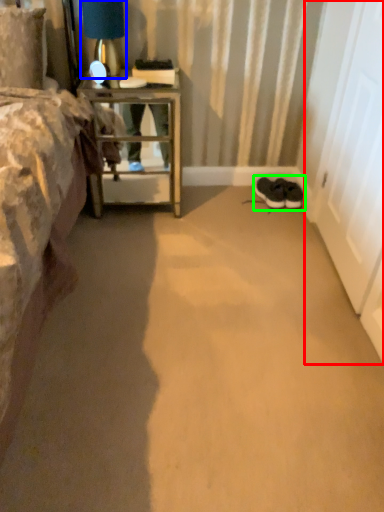
Question: Estimate the real-world distances between objects in this image. Which object is farther from screen door (highlighted by a red box), table lamp (highlighted by a blue box) or footwear (highlighted by a green box)?

Choices:
 (A) table lamp
 (B) footwear

Answer: (A)